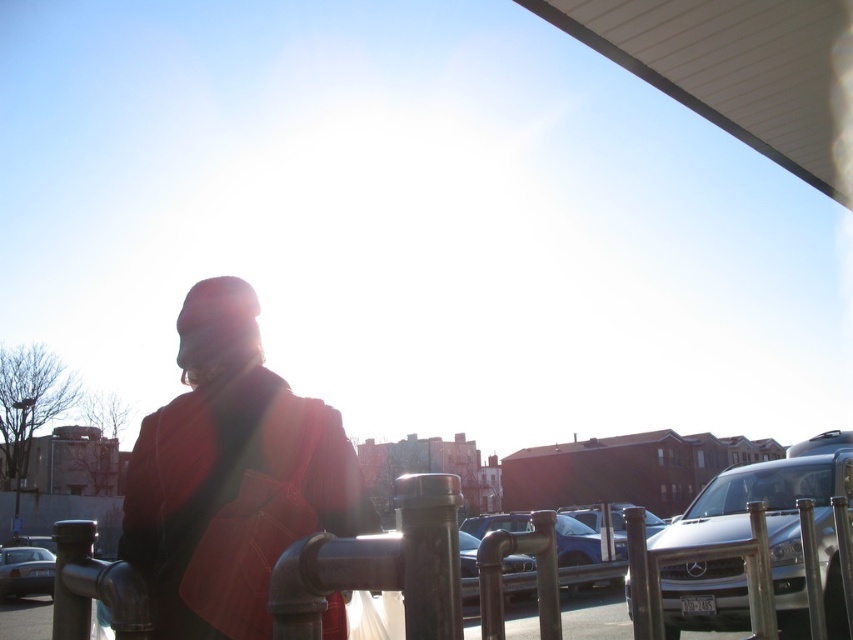
Question: Can you confirm if silver metallic suv at lower right is smaller than silver metallic car at lower left?

Choices:
 (A) yes
 (B) no

Answer: (B)

Question: Can you confirm if matte red coat at center is smaller than silver metallic car at lower left?

Choices:
 (A) no
 (B) yes

Answer: (B)

Question: Which point is closer to the camera taking this photo?

Choices:
 (A) (843, 480)
 (B) (22, 580)

Answer: (A)

Question: Which is farther from the matte red coat at center?

Choices:
 (A) silver metallic car at lower left
 (B) silver metallic suv at lower right

Answer: (A)

Question: Which object is farther from the camera taking this photo?

Choices:
 (A) matte red coat at center
 (B) silver metallic suv at lower right
 (C) silver metallic car at lower left

Answer: (C)

Question: Does silver metallic suv at lower right appear under silver metallic car at lower left?

Choices:
 (A) yes
 (B) no

Answer: (B)